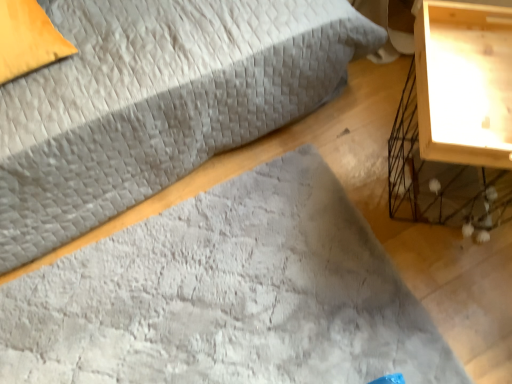
Question: Is velvet gray bed at center inside the boundaries of wooden nightstand at right, or outside?

Choices:
 (A) outside
 (B) inside

Answer: (A)

Question: Considering the positions of point (31, 152) and point (503, 211), is point (31, 152) closer or farther from the camera than point (503, 211)?

Choices:
 (A) closer
 (B) farther

Answer: (A)

Question: Which object is positioned closest to the velvet gray bed at center?

Choices:
 (A) orange fabric pillow at upper left
 (B) textured gray mat at center
 (C) wooden nightstand at right

Answer: (A)

Question: Which object is the farthest from the textured gray mat at center?

Choices:
 (A) wooden nightstand at right
 (B) velvet gray bed at center
 (C) orange fabric pillow at upper left

Answer: (C)